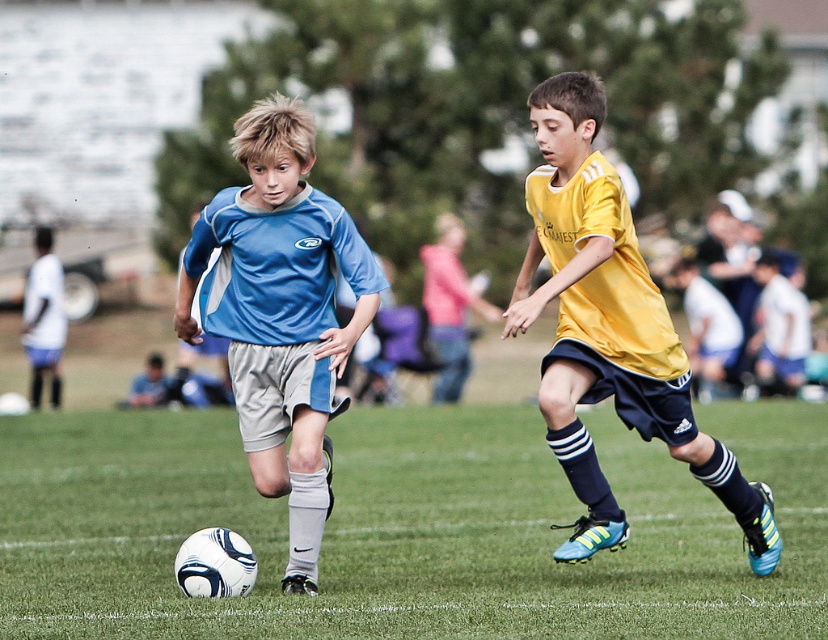
Question: Can you confirm if green grass at center is positioned below yellow matte jersey at center?

Choices:
 (A) yes
 (B) no

Answer: (A)

Question: Which of the following is the closest to the observer?

Choices:
 (A) blue jersey at center
 (B) yellow matte jersey at center
 (C) green grass at center

Answer: (C)

Question: Which object appears farthest from the camera in this image?

Choices:
 (A) blue jersey at center
 (B) green grass at center
 (C) yellow matte jersey at center

Answer: (A)

Question: Estimate the real-world distances between objects in this image. Which object is closer to the green grass at center?

Choices:
 (A) yellow matte jersey at center
 (B) blue jersey at center

Answer: (A)

Question: Observing the image, what is the correct spatial positioning of blue jersey at center in reference to yellow matte jersey at center?

Choices:
 (A) right
 (B) left

Answer: (B)

Question: Can you confirm if green grass at center is positioned above yellow matte jersey at center?

Choices:
 (A) no
 (B) yes

Answer: (A)